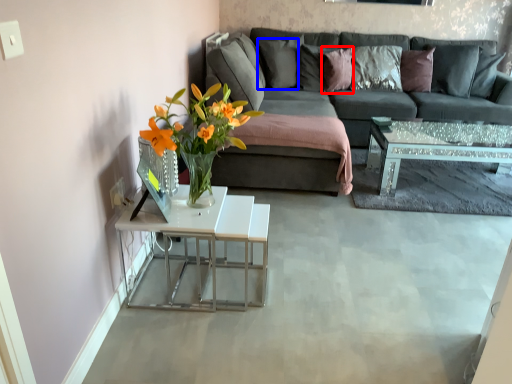
Question: Which of the following is the farthest to the observer, pillow (highlighted by a red box) or pillow (highlighted by a blue box)?

Choices:
 (A) pillow
 (B) pillow

Answer: (B)